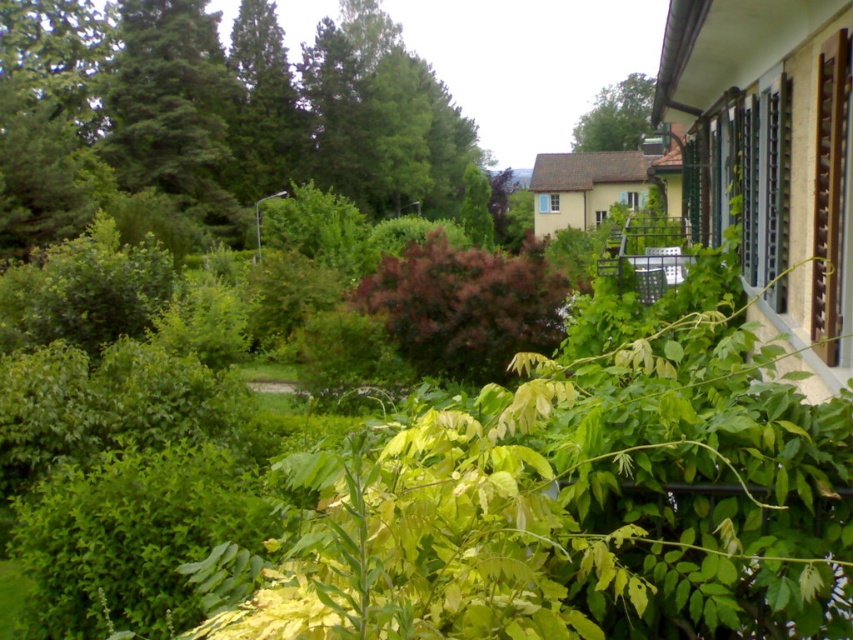
Question: Which point is farther to the camera?

Choices:
 (A) green leafy tree at upper center
 (B) purple matte bush at center

Answer: (A)

Question: Considering the relative positions of purple matte bush at center and green leafy tree at upper center in the image provided, where is purple matte bush at center located with respect to green leafy tree at upper center?

Choices:
 (A) right
 (B) left

Answer: (B)

Question: Can you confirm if green leafy tree at upper left is positioned to the left of green matte tree at upper left?

Choices:
 (A) yes
 (B) no

Answer: (B)

Question: Which point is farther to the camera?

Choices:
 (A) green matte tree at upper left
 (B) green leafy tree at upper center

Answer: (B)

Question: Among these points, which one is farthest from the camera?

Choices:
 (A) (635, 108)
 (B) (125, 29)
 (C) (184, 156)

Answer: (A)

Question: Can you confirm if green matte tree at upper left is positioned to the right of green leafy tree at upper center?

Choices:
 (A) yes
 (B) no

Answer: (B)